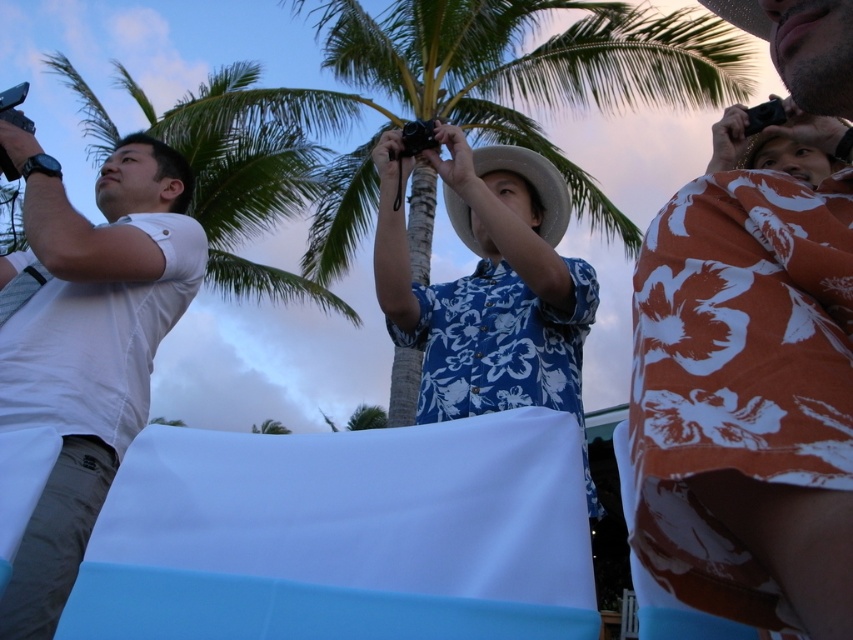
You are standing in the tropical scene and want to take a photo of the white matte shirt at left without the green leafy palm tree at center blocking the view. Is this possible?

The green leafy palm tree at center is above the white matte shirt at left, so you can take a photo of the white matte shirt at left without the palm tree blocking the view by positioning yourself below the palm tree.

You are a photographer trying to position two subjects in a photo. The subjects are wearing a white matte shirt at left and a blue floral shirt at center. Based on their current positions, which subject is positioned more to the left side of the frame?

The white matte shirt at left is positioned more to the left side of the frame than the blue floral shirt at center.

In the scene shown: You are a photographer trying to compose a shot that includes both the white matte shirt at left and the blue floral shirt at center. Which shirt should you adjust to ensure both are fully visible in the frame?

The white matte shirt at left is shorter than the blue floral shirt at center, so you should lower the camera angle slightly to include the full height of both shirts in the frame.